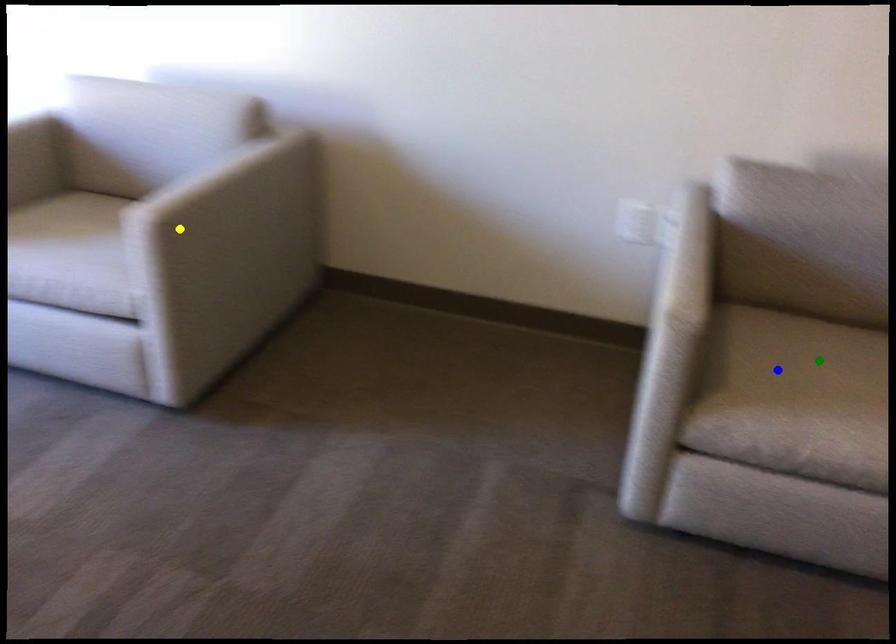
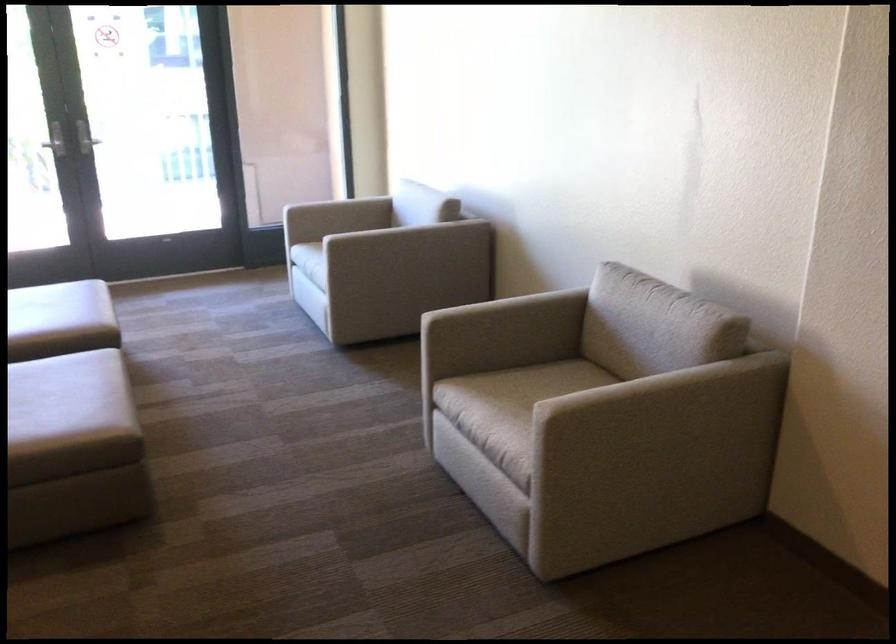
I am providing you with two images of the same scene from different viewpoints. Three points are marked in image1. Which point corresponds to a part or object that is occluded in image2?In image1, three points are marked. Which of them correspond to a part or object that is occluded in image2?Among the three points shown in image1, which one corresponds to a part or object that is no longer visible due to occlusion in image2?

Invisible in image2: green point.